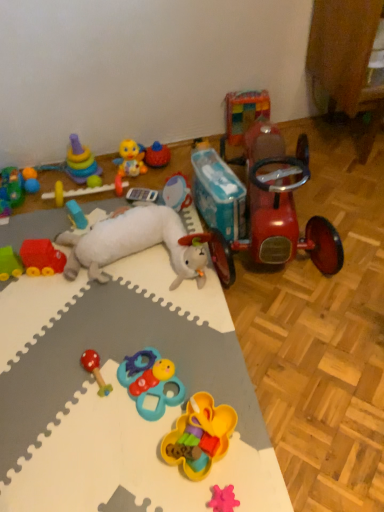
This screenshot has width=384, height=512. In order to click on free area in between rubberized yellow flower-shaped toy at center, the tenth toy in the left-to-right sequence, and blue rubber rattle at center, marked as the 8th toy in a left-to-right arrangement in this screenshot , I will do `click(179, 414)`.